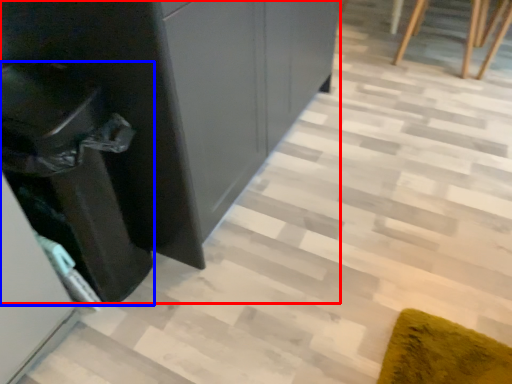
Question: Which object is further to the camera taking this photo, dresser (highlighted by a red box) or cabinetry (highlighted by a blue box)?

Choices:
 (A) dresser
 (B) cabinetry

Answer: (A)